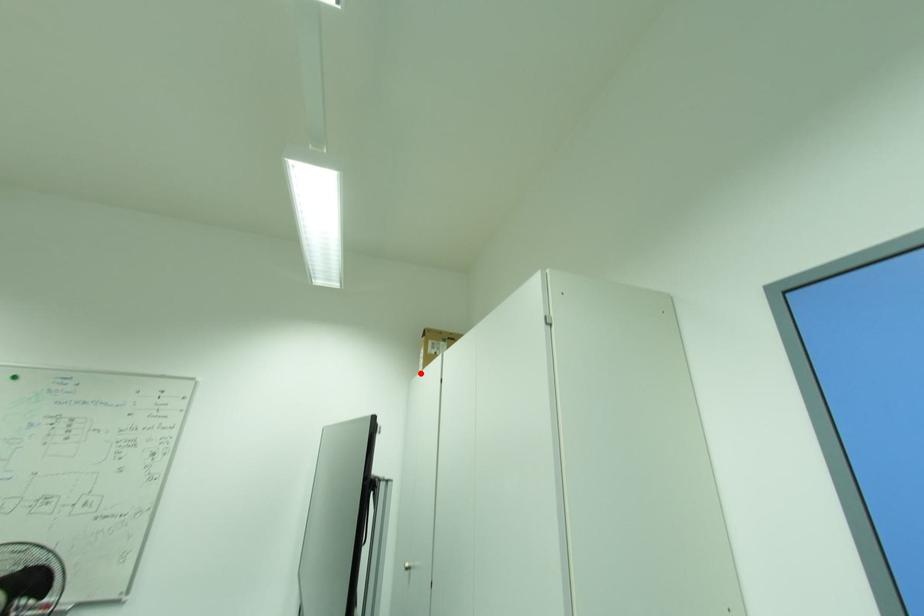
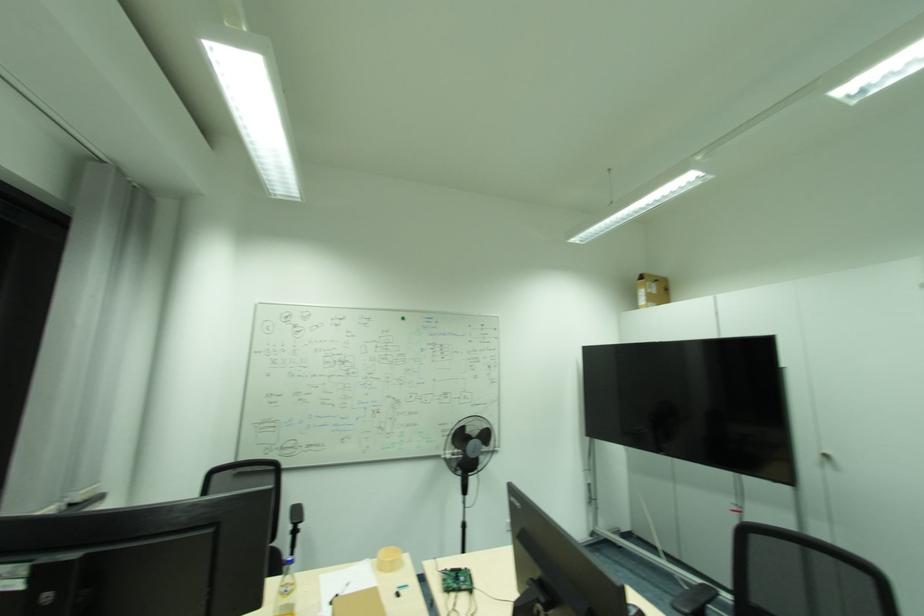
Where in the second image is the point corresponding to the highlighted location from the first image?

(639, 307)